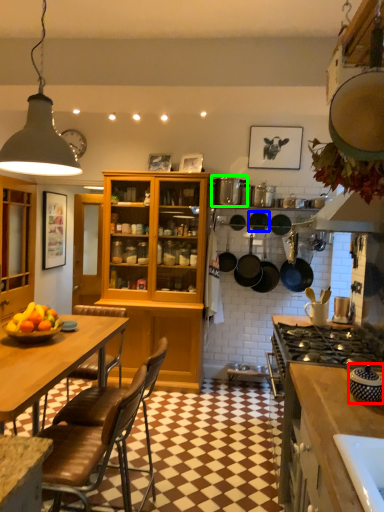
Question: Which is nearer to the appliance (highlighted by a red box)? frying pan (highlighted by a blue box) or appliance (highlighted by a green box).

Choices:
 (A) frying pan
 (B) appliance

Answer: (B)